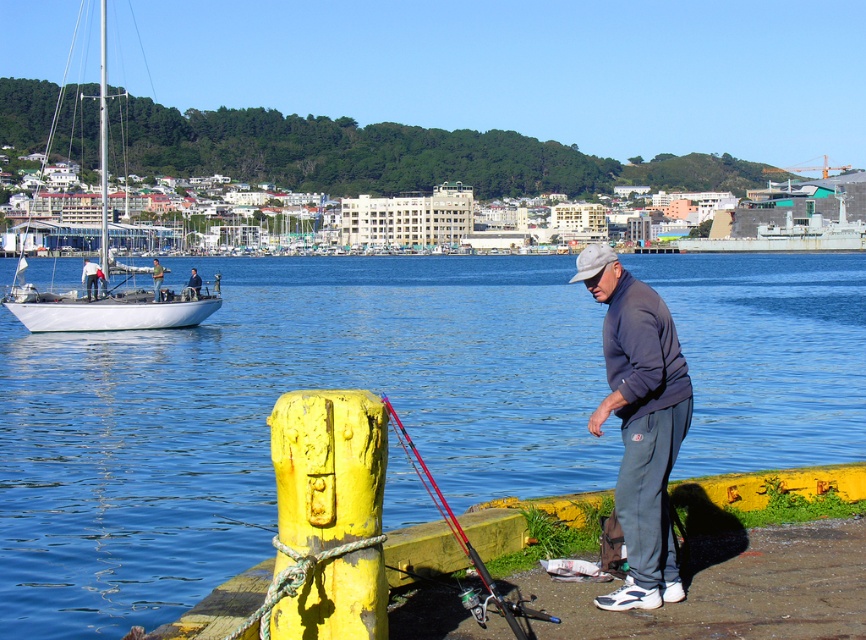
Question: Estimate the real-world distances between objects in this image. Which object is closer to the red fiberglass fishing pole at lower center?

Choices:
 (A) blue water at center
 (B) green fabric shirt at center
 (C) matte black jacket at lower right

Answer: (B)

Question: In this image, where is red fiberglass fishing pole at lower center located relative to matte gray jacket at lower right?

Choices:
 (A) above
 (B) below

Answer: (B)

Question: Does blue water at center have a smaller size compared to white glossy sailboat at left?

Choices:
 (A) no
 (B) yes

Answer: (B)

Question: Can you confirm if blue water at center is thinner than red fiberglass fishing pole at lower center?

Choices:
 (A) no
 (B) yes

Answer: (A)

Question: Among these points, which one is nearest to the camera?

Choices:
 (A) pyautogui.click(x=404, y=368)
 (B) pyautogui.click(x=27, y=310)
 (C) pyautogui.click(x=677, y=403)
 (D) pyautogui.click(x=154, y=291)

Answer: (C)

Question: Which point is farther to the camera?

Choices:
 (A) (78, 481)
 (B) (440, 493)

Answer: (A)